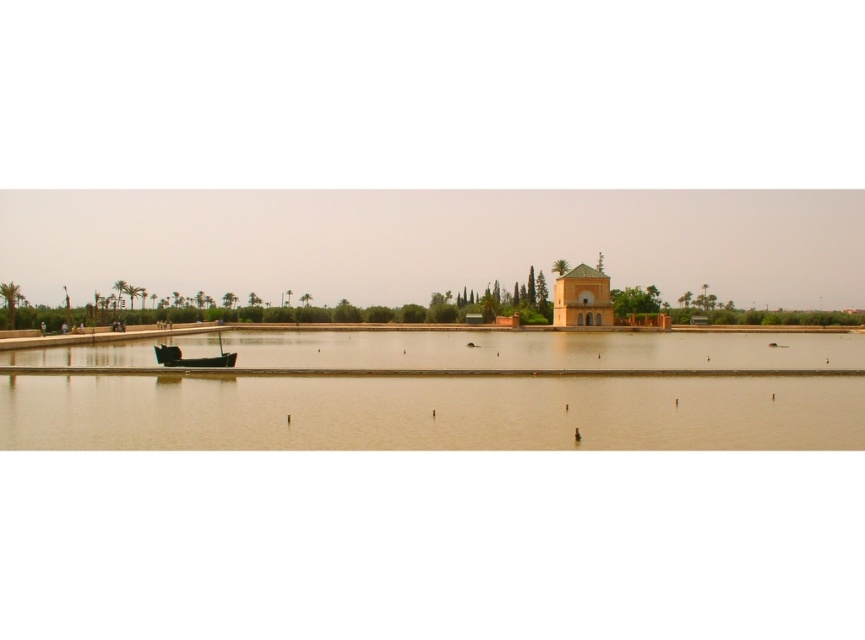
Question: Considering the real-world distances, which object is farthest from the brown matte water at center?

Choices:
 (A) wooden boat at center
 (B) golden stone palace at center

Answer: (B)

Question: Which point is farther to the camera?

Choices:
 (A) (199, 364)
 (B) (542, 445)
 (C) (585, 314)

Answer: (C)

Question: Can you confirm if brown matte water at center is positioned to the right of wooden boat at center?

Choices:
 (A) yes
 (B) no

Answer: (A)

Question: Is golden stone palace at center positioned in front of wooden boat at center?

Choices:
 (A) no
 (B) yes

Answer: (A)

Question: Does brown matte water at center have a smaller size compared to golden stone palace at center?

Choices:
 (A) no
 (B) yes

Answer: (A)

Question: Which point is closer to the camera taking this photo?

Choices:
 (A) (155, 349)
 (B) (593, 300)

Answer: (A)